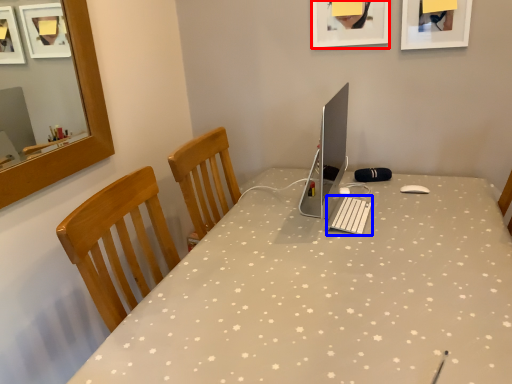
Question: Which of the following is the closest to the observer, picture frame (highlighted by a red box) or laptop keyboard (highlighted by a blue box)?

Choices:
 (A) picture frame
 (B) laptop keyboard

Answer: (B)